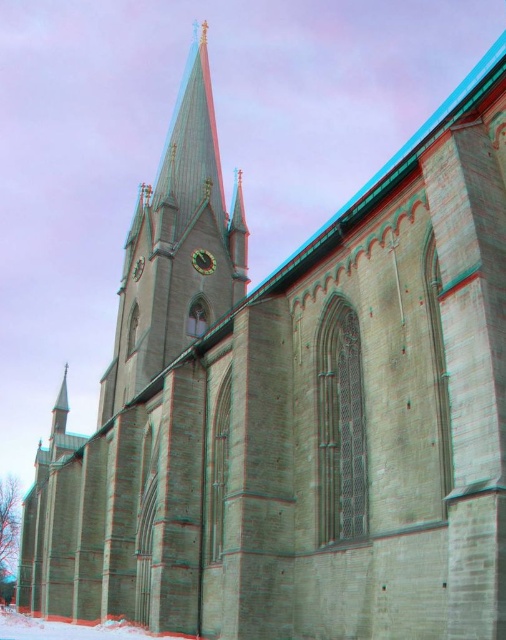
Is green stone steeple at upper center to the left of metallic clock at center from the viewer's perspective?

Yes, green stone steeple at upper center is to the left of metallic clock at center.

Who is more forward, (147, 317) or (212, 259)?

Positioned in front is point (147, 317).

Locate an element on the screen. The image size is (506, 640). green stone steeple at upper center is located at coordinates click(x=177, y=248).